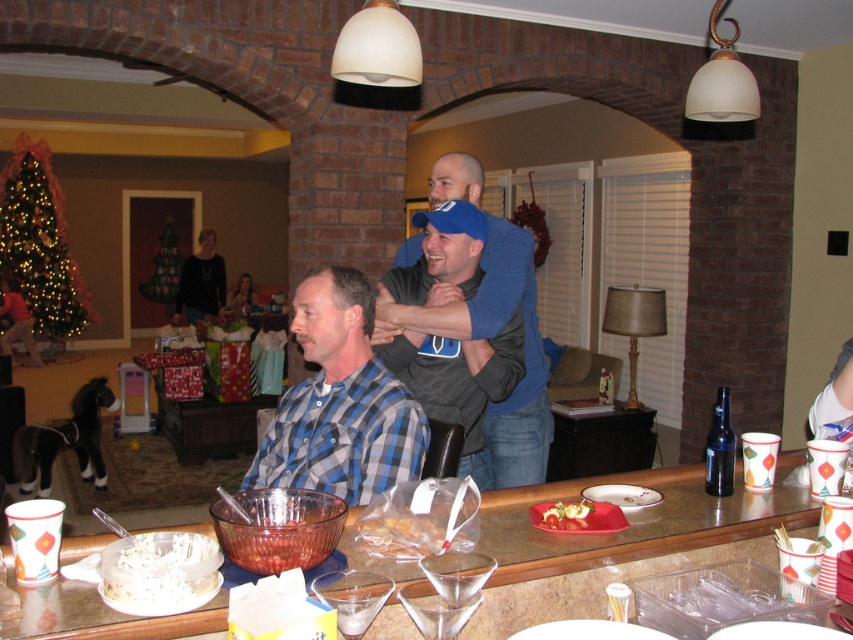
Question: Observing the image, what is the correct spatial positioning of transparent plastic martini glass at lower center in reference to smooth white cheese at center?

Choices:
 (A) left
 (B) right

Answer: (A)

Question: Considering the relative positions of blue plaid shirt at center and black sweater at upper left in the image provided, where is blue plaid shirt at center located with respect to black sweater at upper left?

Choices:
 (A) below
 (B) above

Answer: (A)

Question: Among these objects, which one is farthest from the camera?

Choices:
 (A) white crumbly cake at lower left
 (B) transparent plastic martini glass at lower center
 (C) smooth white cheese at center
 (D) translucent glass table at center

Answer: (C)

Question: Which point is farther to the camera?

Choices:
 (A) (486, 330)
 (B) (541, 515)
 (C) (387, 394)

Answer: (A)

Question: Considering the relative positions of black sweater at upper left and transparent plastic martini glass at lower center in the image provided, where is black sweater at upper left located with respect to transparent plastic martini glass at lower center?

Choices:
 (A) left
 (B) right

Answer: (A)

Question: Which object is positioned farthest from the transparent plastic martini glass at lower center?

Choices:
 (A) smooth white cheese at center
 (B) blue fabric shirt at center
 (C) blue plaid shirt at center

Answer: (B)